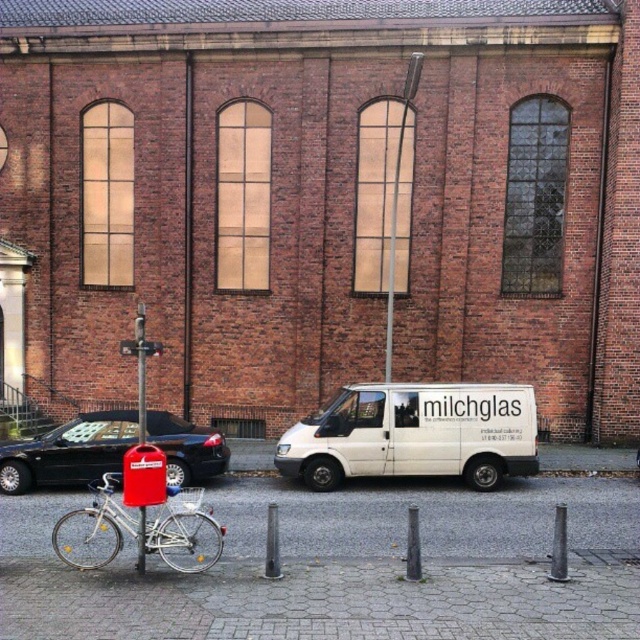
Between shiny black car at lower left and silver metallic bicycle at lower left, which one is positioned higher?

shiny black car at lower left

Does shiny black car at lower left appear on the left side of silver metallic bicycle at lower left?

Indeed, shiny black car at lower left is positioned on the left side of silver metallic bicycle at lower left.

Is point (186, 445) behind point (204, 563)?

Yes, point (186, 445) is farther from viewer.

This screenshot has width=640, height=640. In order to click on shiny black car at lower left in this screenshot , I will do `click(68, 451)`.

Who is lower down, white matte van at center or shiny black car at lower left?

shiny black car at lower left

The width and height of the screenshot is (640, 640). What do you see at coordinates (413, 435) in the screenshot?
I see `white matte van at center` at bounding box center [413, 435].

What do you see at coordinates (413, 435) in the screenshot? I see `white matte van at center` at bounding box center [413, 435].

Where is `white matte van at center`? The width and height of the screenshot is (640, 640). white matte van at center is located at coordinates (413, 435).

Does white matte van at center have a greater width compared to silver metallic bicycle at lower left?

Yes.

Which is more to the left, white matte van at center or silver metallic bicycle at lower left?

silver metallic bicycle at lower left is more to the left.

You are a GUI agent. You are given a task and a screenshot of the screen. Output one action in this format:
    pyautogui.click(x=<x>, y=<y>)
    Task: Click on the white matte van at center
    The width and height of the screenshot is (640, 640).
    Given the screenshot: What is the action you would take?
    413,435

Find the location of a particular element. The height and width of the screenshot is (640, 640). white matte van at center is located at coordinates (413, 435).